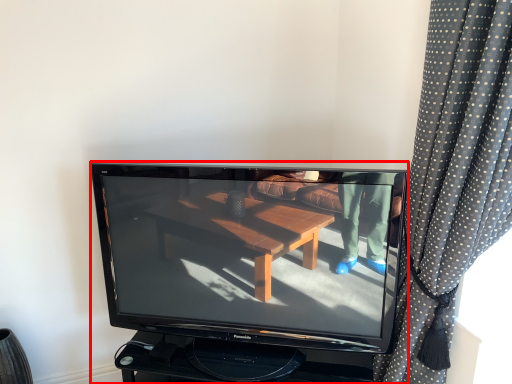
Question: From the image's perspective, considering the relative positions of television (annotated by the red box) and curtain in the image provided, where is television (annotated by the red box) located with respect to the staircase?

Choices:
 (A) above
 (B) below

Answer: (B)